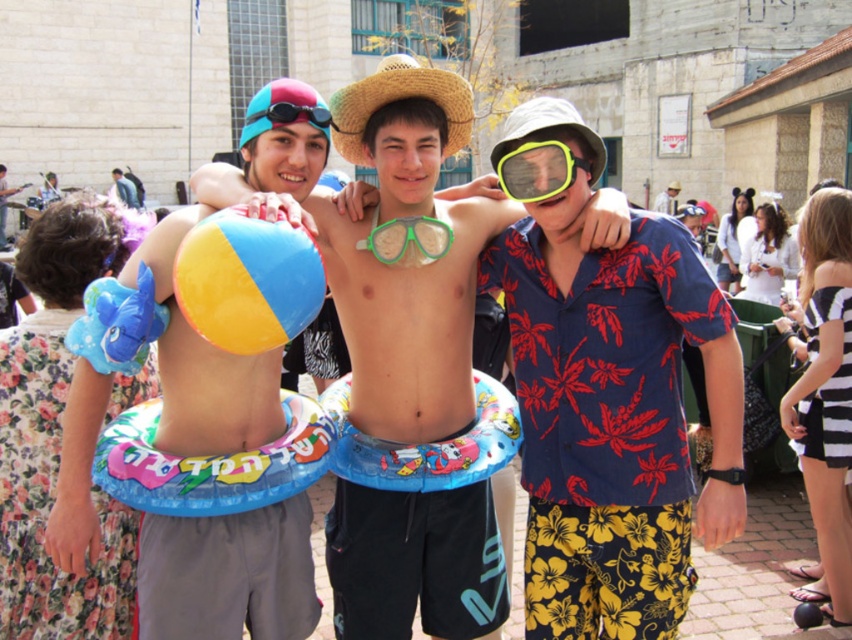
Question: Does matte plastic beach ball at left have a greater width compared to yellowmattebeach ball at center?

Choices:
 (A) no
 (B) yes

Answer: (B)

Question: Among these objects, which one is farthest from the camera?

Choices:
 (A) blue rubber ring at upper left
 (B) matte plastic beach ball at left
 (C) blue rubber ring at lower left

Answer: (A)

Question: Considering the relative positions of blue rubber ring at upper left and white cotton shirt at center in the image provided, where is blue rubber ring at upper left located with respect to white cotton shirt at center?

Choices:
 (A) left
 (B) right

Answer: (A)

Question: Among these points, which one is nearest to the camera?

Choices:
 (A) (511, 172)
 (B) (407, 248)
 (C) (130, 204)
 (D) (669, 205)

Answer: (A)

Question: Is blue rubber ring at lower left closer to camera compared to blue rubber ring at upper left?

Choices:
 (A) no
 (B) yes

Answer: (B)

Question: Which point is farther to the camera?

Choices:
 (A) matte plastic beach ball at center
 (B) floral print shirt at center
 (C) blue rubber ring at lower left

Answer: (C)